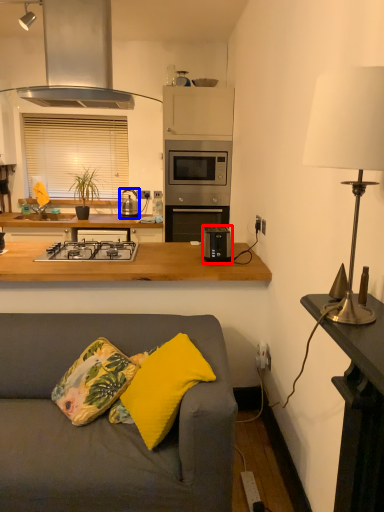
Question: Among these objects, which one is farthest to the camera, toaster (highlighted by a red box) or appliance (highlighted by a blue box)?

Choices:
 (A) toaster
 (B) appliance

Answer: (B)